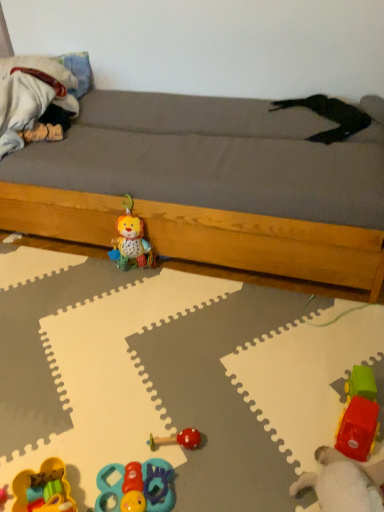
Identify the location of vacant space that is to the left of smooth plastic rattle at center, acting as the fourth toy starting from the left. (116, 434).